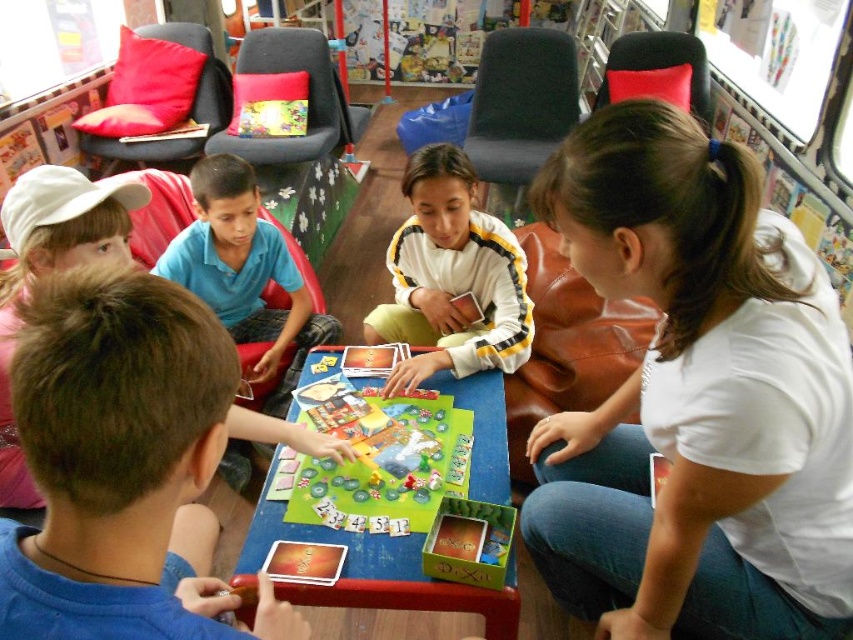
Looking at this image, you are a photographer standing in the room. You need to take a photo of the brown hair at lower left and the white cap at upper left. Which object is closer to the camera?

The brown hair at lower left is below the white cap at upper left, so it is closer to the camera.

You are a photographer trying to capture a candid shot of the children playing the board game. You notice the brown hair at lower left and the white fleece sweater at center. Which object is narrower in width when viewed from your perspective?

The brown hair at lower left is narrower in width than the white fleece sweater at center.

You are a parent trying to locate your child in a busy classroom. You remember your child is wearing a white fleece sweater at center and has a white cap at upper left. If you are standing at the entrance, which object is closer to you?

The white cap at upper left is closer to you since it is located at upper left, while the white fleece sweater at center is further away.